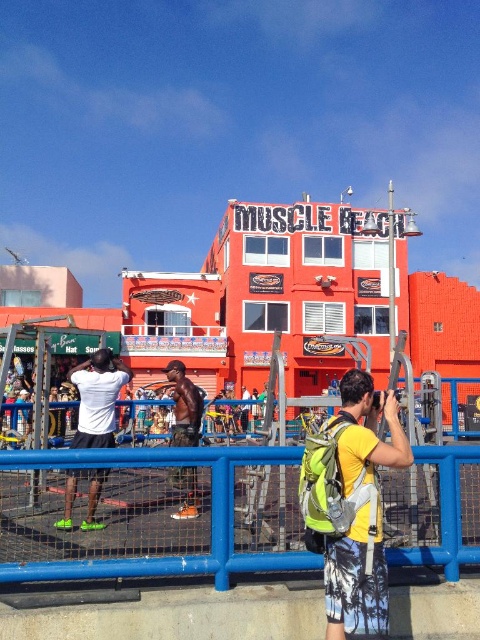
Does blue metal fence at lower center appear on the left side of yellow fabric backpack at lower right?

Yes, blue metal fence at lower center is to the left of yellow fabric backpack at lower right.

Between blue metal fence at lower center and yellow fabric backpack at lower right, which one is positioned higher?

yellow fabric backpack at lower right

Between point (417, 552) and point (354, 548), which one is positioned behind?

Positioned behind is point (417, 552).

Find the location of `blue metal fence at lower center`. blue metal fence at lower center is located at coordinates (166, 556).

Is yellow fabric backpack at lower right further to camera compared to black matte shorts at center?

That is False.

From the picture: Does yellow fabric backpack at lower right come in front of black matte shorts at center?

Yes, it is.

The image size is (480, 640). I want to click on yellow fabric backpack at lower right, so click(351, 506).

Does yellow fabric safety vest at lower right appear on the right side of black matte shorts at center?

Yes, yellow fabric safety vest at lower right is to the right of black matte shorts at center.

Is point (355, 420) positioned after point (105, 380)?

No, (355, 420) is closer to viewer.

Who is more forward, (330, 516) or (62, 529)?

Positioned in front is point (330, 516).

Where is `yellow fabric safety vest at lower right`? This screenshot has height=640, width=480. yellow fabric safety vest at lower right is located at coordinates (335, 484).